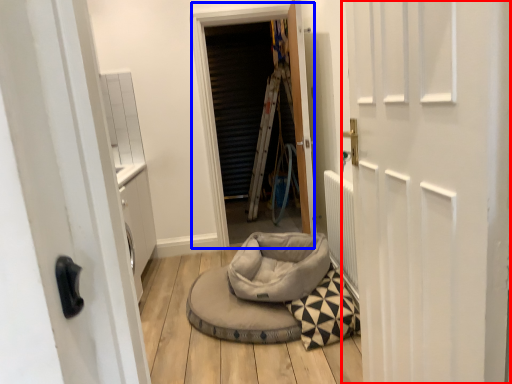
Question: Which point is further to the camera, door (highlighted by a red box) or window screen (highlighted by a blue box)?

Choices:
 (A) door
 (B) window screen

Answer: (B)